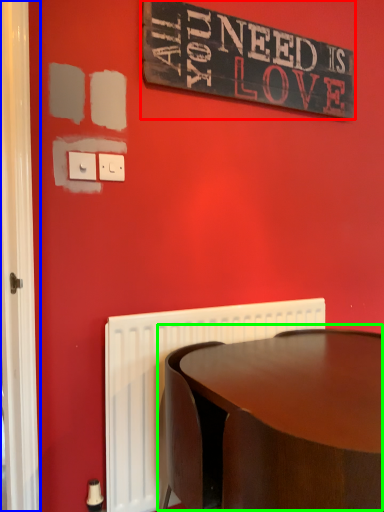
Question: Which is nearer to the bulletin board (highlighted by a red box)? screen door (highlighted by a blue box) or table (highlighted by a green box).

Choices:
 (A) screen door
 (B) table

Answer: (A)